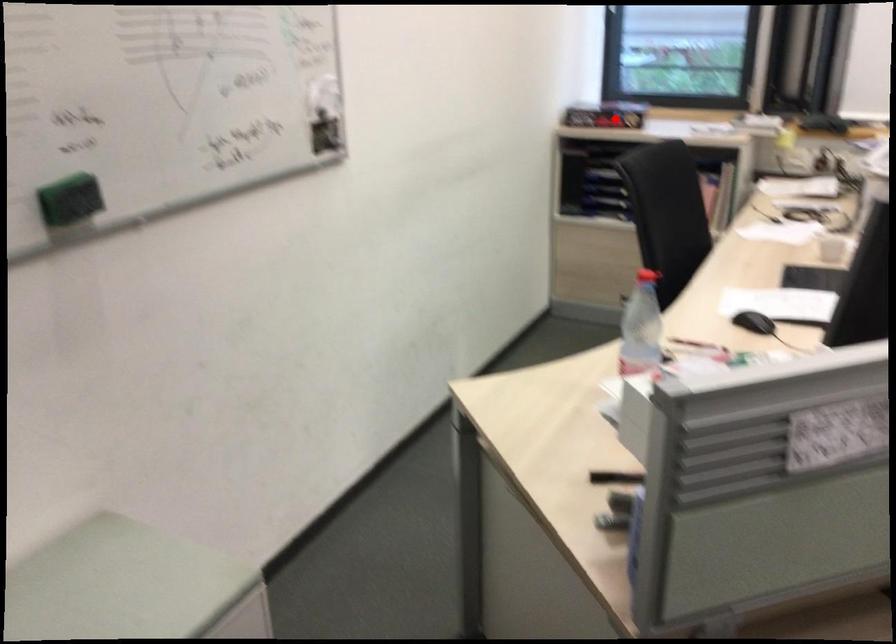
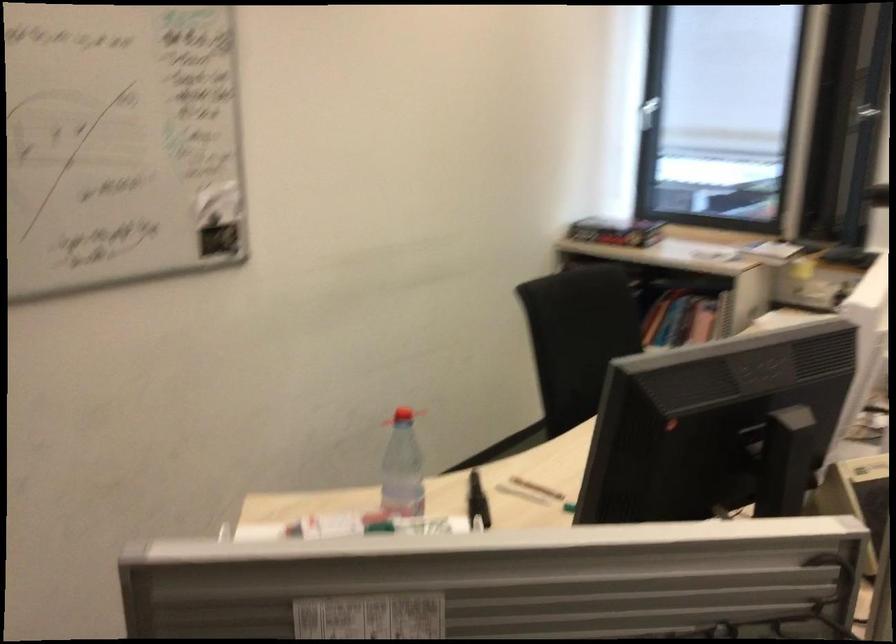
The point at the highlighted location is marked in the first image. Where is the corresponding point in the second image?

(615, 232)